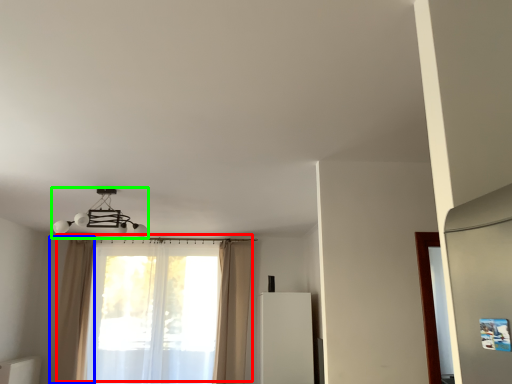
Question: Which object is the closest to the curtain (highlighted by a red box)? Choose among these: curtain (highlighted by a blue box) or lamp (highlighted by a green box).

Choices:
 (A) curtain
 (B) lamp

Answer: (A)